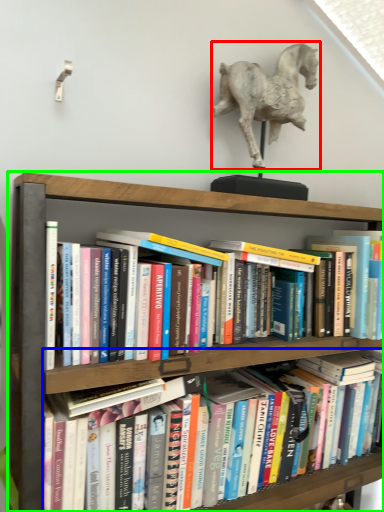
Question: Considering the real-world distances, which object is farthest from horse (highlighted by a red box)? book (highlighted by a blue box) or shelf (highlighted by a green box)?

Choices:
 (A) book
 (B) shelf

Answer: (A)